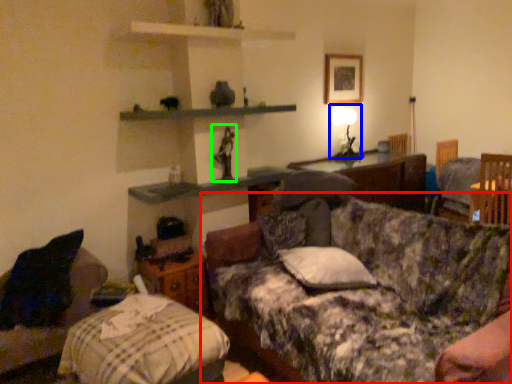
Question: Estimate the real-world distances between objects in this image. Which object is farther from studio couch (highlighted by a red box), table lamp (highlighted by a blue box) or toy (highlighted by a green box)?

Choices:
 (A) table lamp
 (B) toy

Answer: (A)